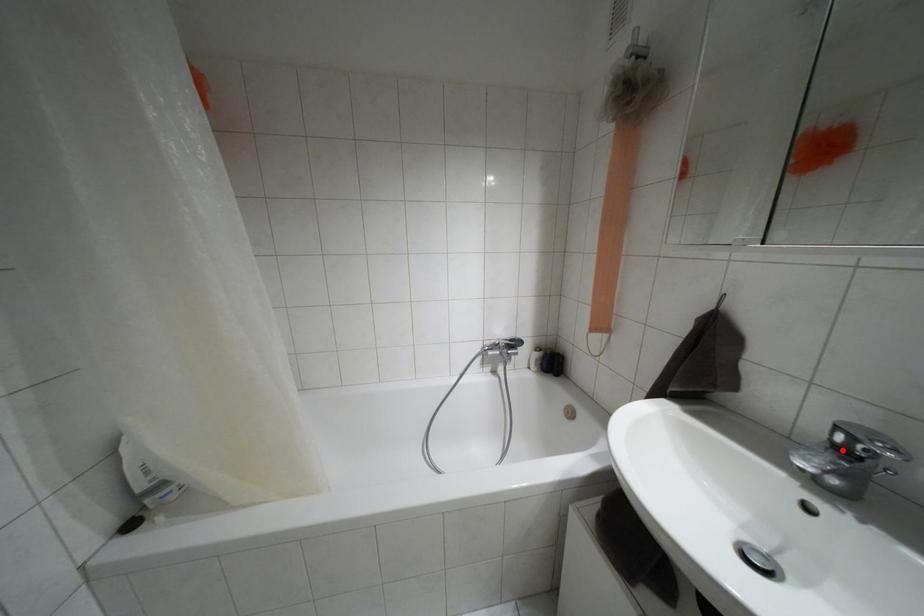
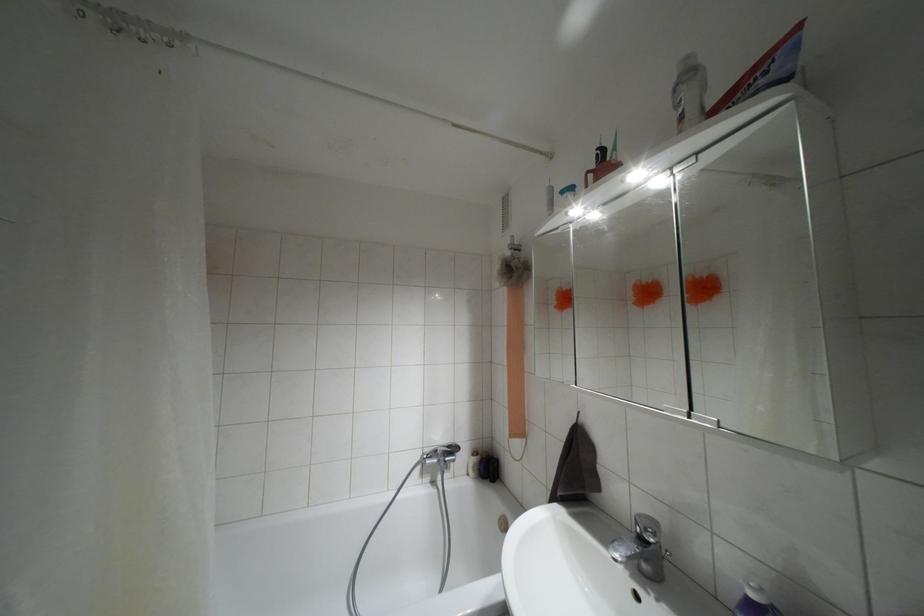
Locate, in the second image, the point that corresponds to the highlighted location in the first image.

(641, 538)